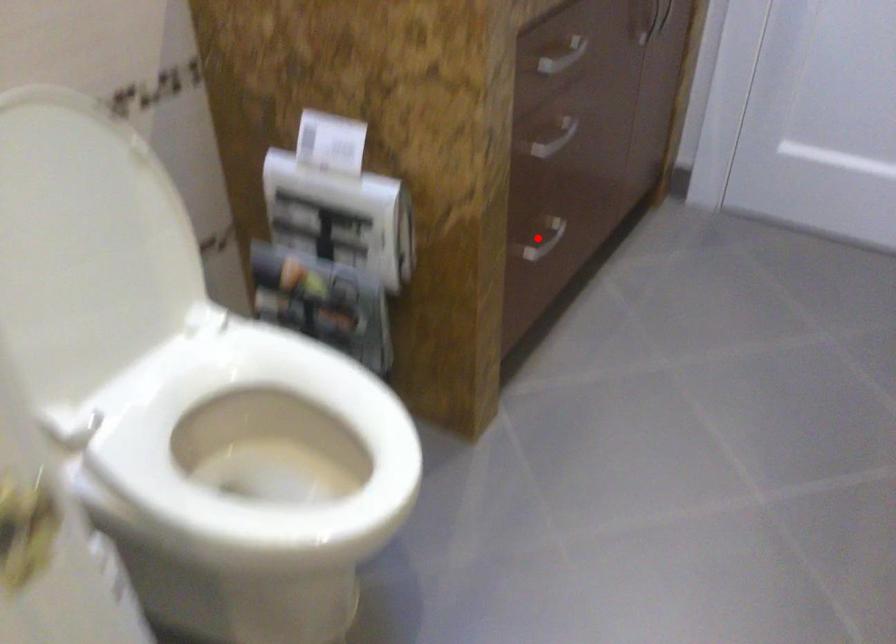
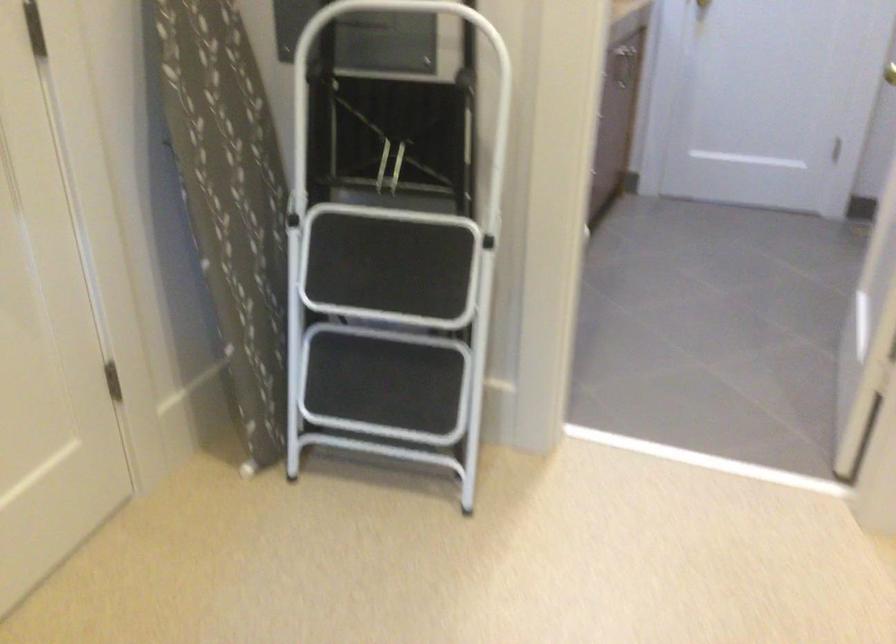
Question: I am providing you with two images of the same scene from different viewpoints. A red point is marked on the first image. Is the red point's position out of view in image 2?

Choices:
 (A) Yes
 (B) No

Answer: (A)